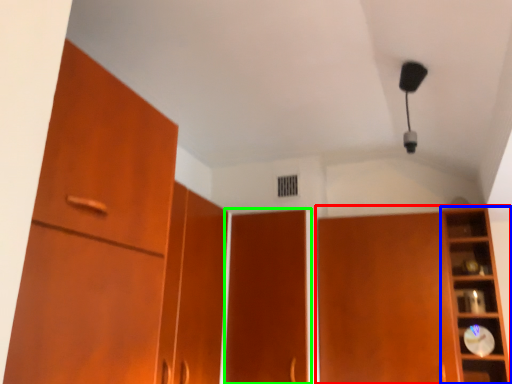
Question: Which is nearer to the cupboard (highlighted by a red box)? shelf (highlighted by a blue box) or door (highlighted by a green box).

Choices:
 (A) shelf
 (B) door

Answer: (A)